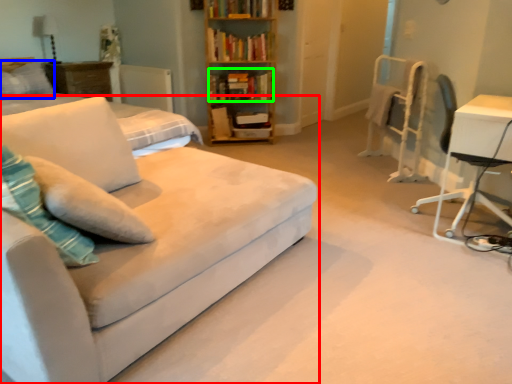
Question: Estimate the real-world distances between objects in this image. Which object is farther from studio couch (highlighted by a red box), pillow (highlighted by a blue box) or book (highlighted by a green box)?

Choices:
 (A) pillow
 (B) book

Answer: (A)